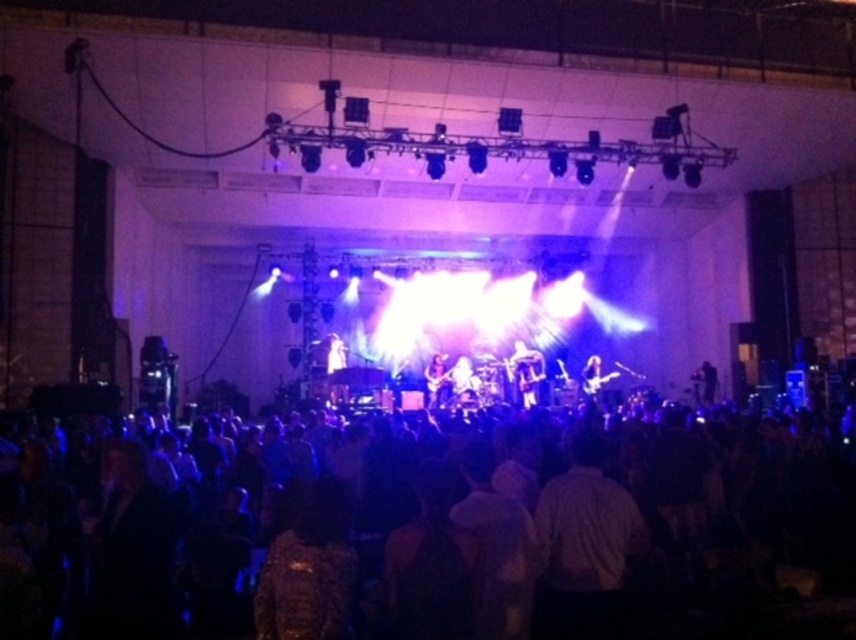
You are a photographer at the concert and want to capture a photo of the shiny black guitar at center without the black fabric crowd at lower center appearing in the foreground. Is this possible based on their positions?

Answer: The black fabric crowd at lower center is located below the shiny black guitar at center, so adjusting the camera angle upwards to focus on the guitar while avoiding the lower area where the crowd is positioned would allow capturing the guitar without the crowd in the foreground.

You are a photographer at the concert. You want to capture a photo that includes both the black fabric crowd at lower center and the shiny silver guitar at center. Which object should you focus on to ensure both are in frame?

Since the black fabric crowd at lower center is bigger than the shiny silver guitar at center, you should focus on the black fabric crowd at lower center to ensure both objects fit within the frame.

You are a stagehand standing at the edge of the stage. You need to quickly retrieve the shiny silver guitar at center from the stage to the backstage. However, there is a black fabric crowd at lower center in the way. Can you safely walk straight to the guitar without stepping into the crowd?

The black fabric crowd at lower center is 16.53 meters away from the shiny silver guitar at center. Since the crowd is 16.53 meters away from the guitar, you can safely walk straight to the guitar without stepping into the crowd as there is enough distance between them.